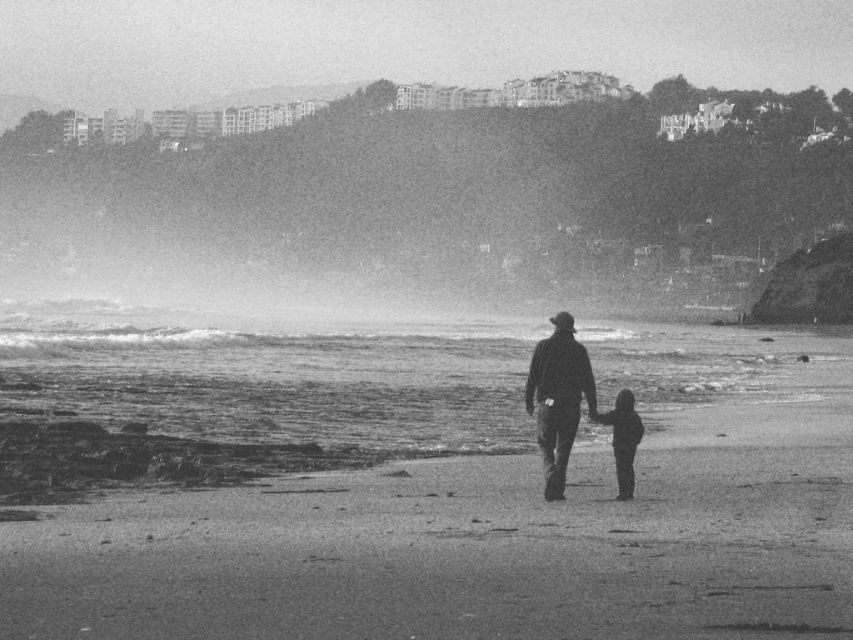
You are standing at the edge of the beach and see the smooth sand beach at center and the dark gray fabric jacket at center. Which object is located to the left of the other?

The smooth sand beach at center is to the left of dark gray fabric jacket at center.

You are standing at the point closest to the viewer in the image. Which point, point (572, 380) or point (611, 428), are you standing at?

You are standing at point (572, 380) because it is in front of point (611, 428).